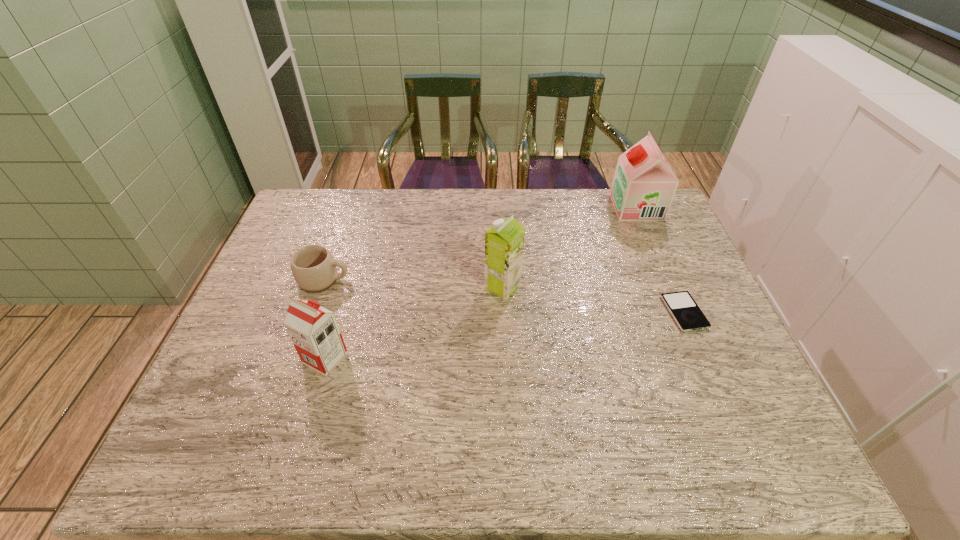
Find the location of a particular element. vacant region at the far edge of the desktop is located at coordinates (564, 195).

The image size is (960, 540). Find the location of `vacant space at the near edge of the desktop`. vacant space at the near edge of the desktop is located at coordinates click(x=671, y=447).

The height and width of the screenshot is (540, 960). Identify the location of vacant space at the left edge of the desktop. (290, 237).

You are a GUI agent. You are given a task and a screenshot of the screen. Output one action in this format:
    pyautogui.click(x=<x>, y=<y>)
    Task: Click on the free space at the right edge of the desktop
    
    Given the screenshot: What is the action you would take?
    pyautogui.click(x=685, y=258)

Where is `free location at the near right corner of the desktop`? The image size is (960, 540). free location at the near right corner of the desktop is located at coordinates (789, 462).

The width and height of the screenshot is (960, 540). I want to click on vacant area that lies between the third object from left to right and the shortest object, so click(x=593, y=300).

Locate an element on the screen. empty space between the farthest soya milk and the iPod is located at coordinates (660, 260).

Where is `vacant point located between the third object from left to right and the rightmost soya milk`? Image resolution: width=960 pixels, height=540 pixels. vacant point located between the third object from left to right and the rightmost soya milk is located at coordinates (569, 247).

Where is `empty space between the nearest object and the farthest soya milk`? The height and width of the screenshot is (540, 960). empty space between the nearest object and the farthest soya milk is located at coordinates (481, 283).

The height and width of the screenshot is (540, 960). In order to click on vacant area that lies between the mug and the second nearest soya milk in this screenshot , I will do `click(413, 283)`.